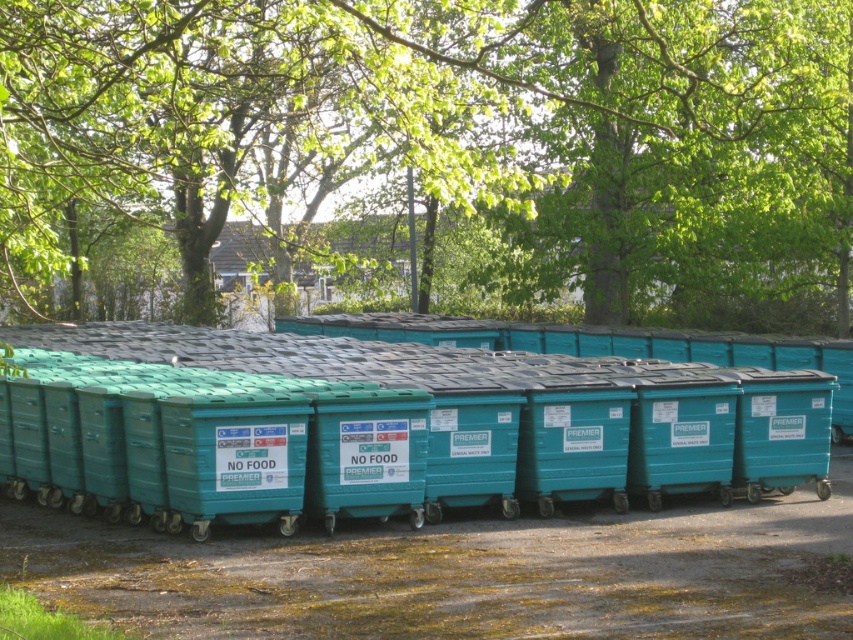
Identify the location of green leafy tree at upper center. (447, 147).

Looking at this image, between green leafy tree at upper center and teal plastic bin at center, which one has less height?

With less height is teal plastic bin at center.

Image resolution: width=853 pixels, height=640 pixels. I want to click on green leafy tree at upper center, so click(447, 147).